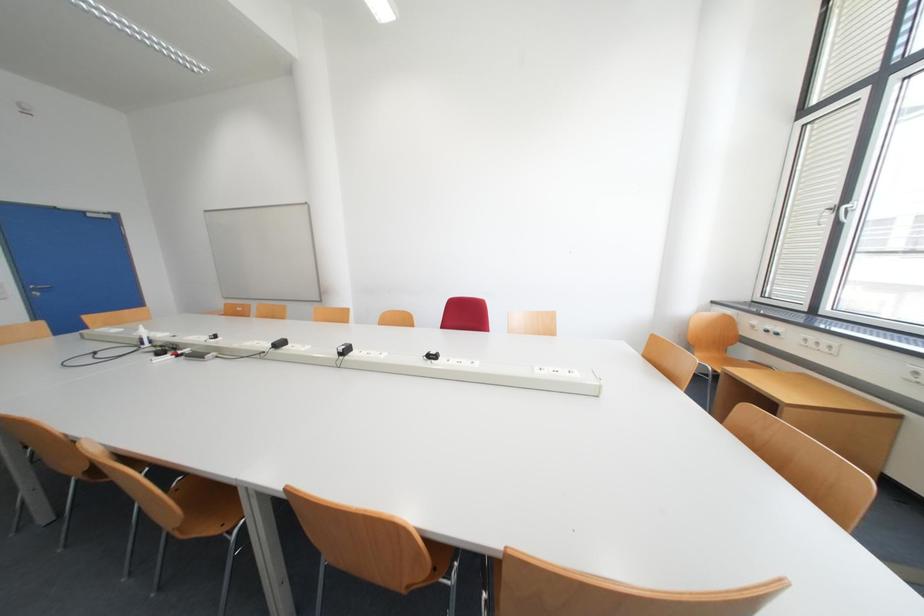
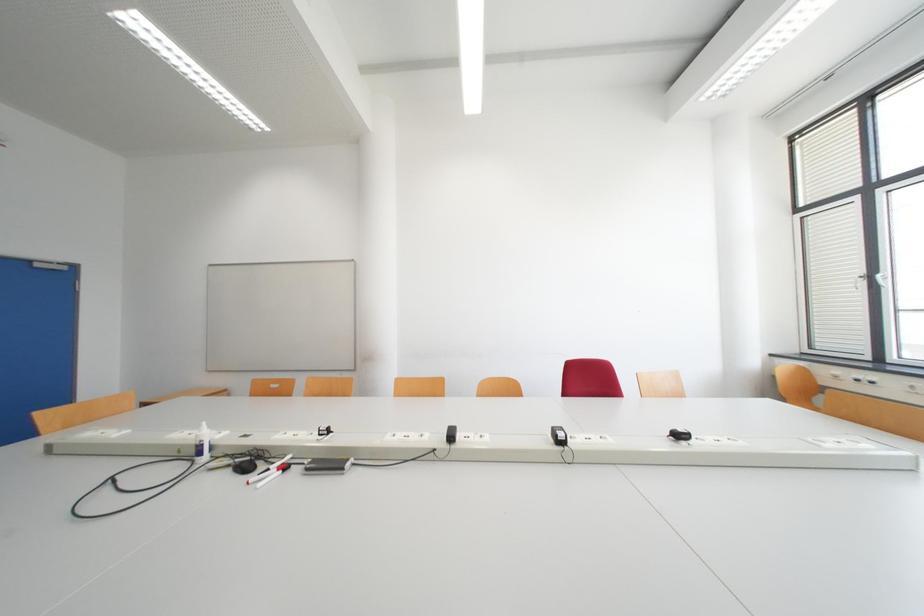
Question: Which direction would the cameraman need to move to produce the second image? Reply with the corresponding letter.

Choices:
 (A) Left
 (B) Right
 (C) Forward
 (D) Backward

Answer: (A)